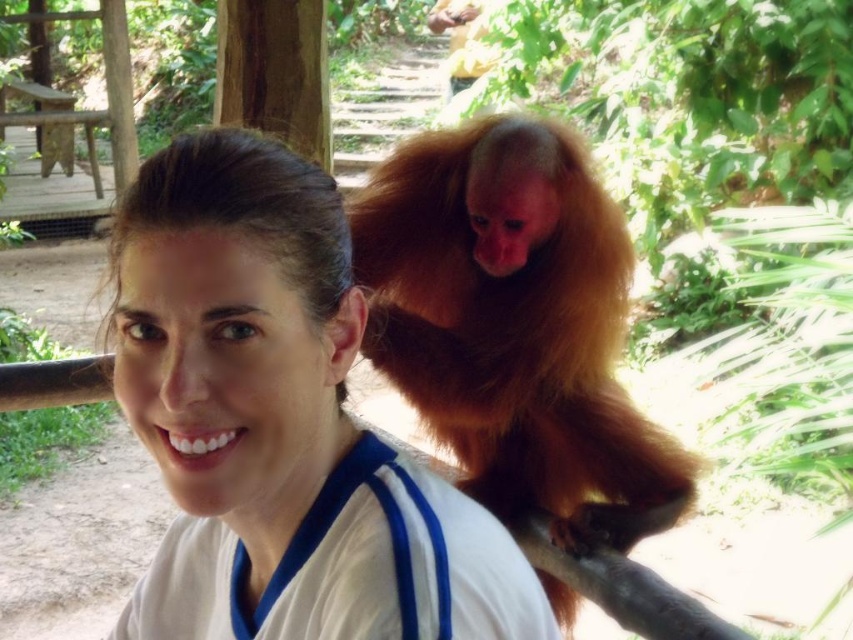
You are a photographer trying to capture a photo of the golden fur monkey at upper right and the white matte shirt at center. Which object is narrower in width?

The white matte shirt at center is thinner than the golden fur monkey at upper right, so the white matte shirt at center is narrower in width.

You are a photographer trying to capture a closeup of the golden fur monkey at upper right. You are currently focused on the white matte shirt at center. Do you need to adjust your focus to get a clear shot of the monkey?

The white matte shirt at center is closer to the viewer than the golden fur monkey at upper right, so you will need to refocus your camera to adjust the focus further away to capture the golden fur monkey at upper right clearly.